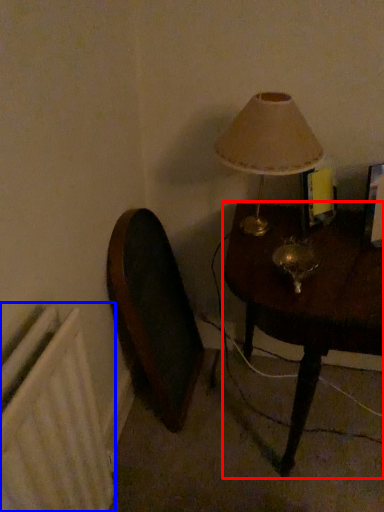
Question: Which point is further to the camera, table (highlighted by a red box) or radiator (highlighted by a blue box)?

Choices:
 (A) table
 (B) radiator

Answer: (A)